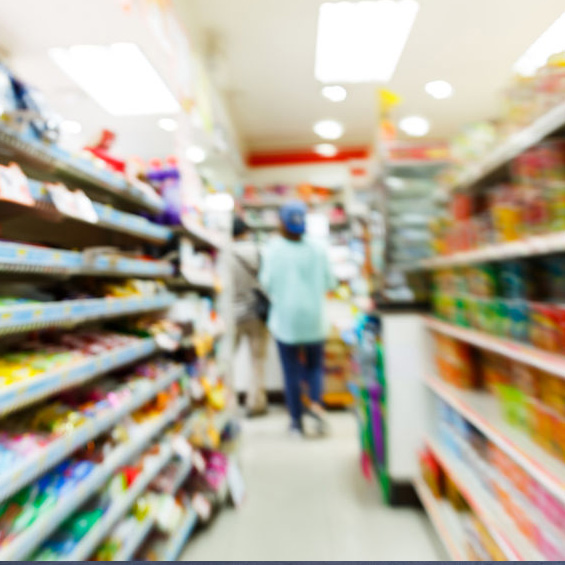
Find the location of `counter`. counter is located at coordinates (333, 314).